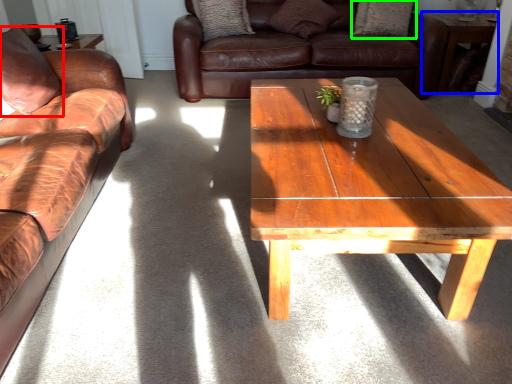
Question: Which object is positioned farthest from pillow (highlighted by a red box)? Select from table (highlighted by a blue box) and pillow (highlighted by a green box).

Choices:
 (A) table
 (B) pillow

Answer: (A)